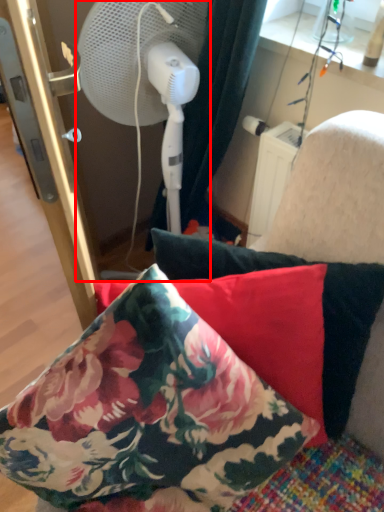
Question: Considering the relative positions of mechanical fan (annotated by the red box) and pillow in the image provided, where is mechanical fan (annotated by the red box) located with respect to the staircase?

Choices:
 (A) left
 (B) right

Answer: (A)